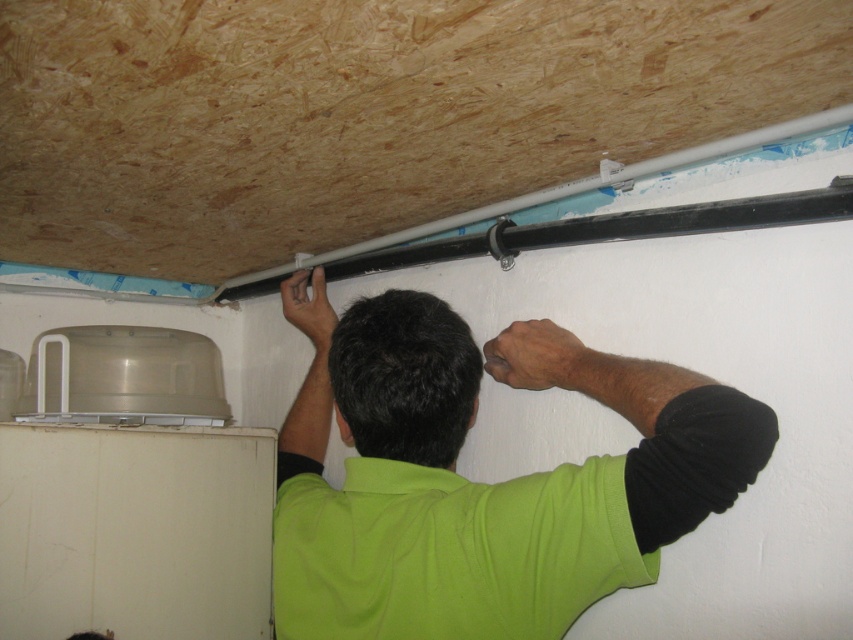
Is point (635, 109) farther from camera compared to point (770, 132)?

No, (635, 109) is in front of (770, 132).

Is white plastic exhaust hood at upper center thinner than white plastic pipe at upper center?

No, white plastic exhaust hood at upper center is not thinner than white plastic pipe at upper center.

Between point (630, 10) and point (347, 246), which one is positioned in front?

Positioned in front is point (630, 10).

Locate an element on the screen. This screenshot has height=640, width=853. white plastic exhaust hood at upper center is located at coordinates (361, 113).

Which is above, green matte shirt at center or white plastic pipe at upper center?

Positioned higher is white plastic pipe at upper center.

The height and width of the screenshot is (640, 853). What do you see at coordinates (480, 483) in the screenshot?
I see `green matte shirt at center` at bounding box center [480, 483].

You are a GUI agent. You are given a task and a screenshot of the screen. Output one action in this format:
    pyautogui.click(x=<x>, y=<y>)
    Task: Click on the green matte shirt at center
    This screenshot has width=853, height=640.
    Given the screenshot: What is the action you would take?
    pyautogui.click(x=480, y=483)

Is white plastic exhaust hood at upper center smaller than green matte shirt at center?

Incorrect, white plastic exhaust hood at upper center is not smaller in size than green matte shirt at center.

Who is shorter, white plastic exhaust hood at upper center or green matte shirt at center?

white plastic exhaust hood at upper center is shorter.

Is point (317, 248) closer to viewer compared to point (630, 552)?

No, it is behind (630, 552).

Find the location of a particular element. The height and width of the screenshot is (640, 853). white plastic exhaust hood at upper center is located at coordinates (361, 113).